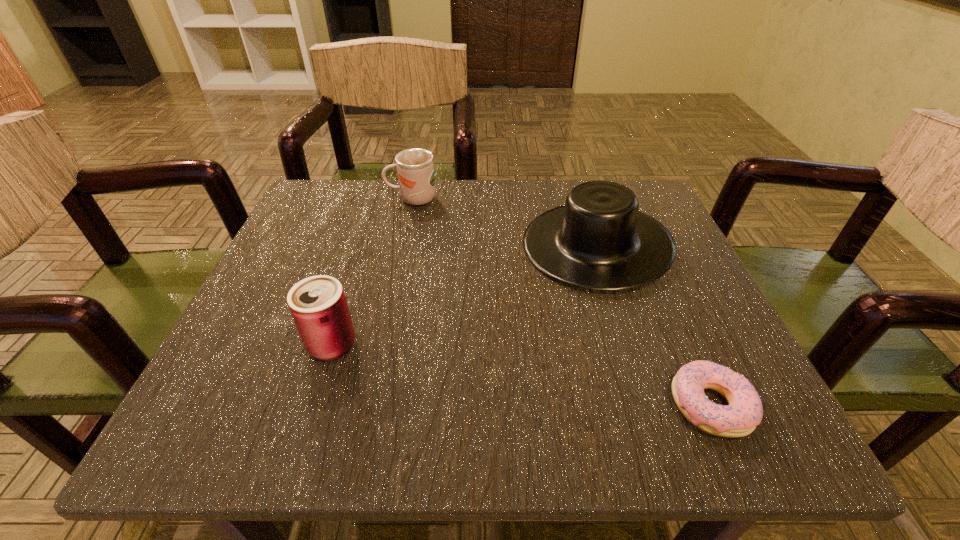
Locate an element on the screen. This screenshot has width=960, height=540. free space at the near edge of the desktop is located at coordinates (584, 416).

You are a GUI agent. You are given a task and a screenshot of the screen. Output one action in this format:
    pyautogui.click(x=<x>, y=<y>)
    Task: Click on the vacant region at the right edge
    This screenshot has height=540, width=960.
    Given the screenshot: What is the action you would take?
    pyautogui.click(x=663, y=314)

At what (x,y) coordinates should I click in order to perform the action: click on free region at the far left corner of the desktop. Please return your answer as a coordinate pair (x, y). Looking at the image, I should click on (312, 199).

In the image, there is a desktop. Find the location of `vacant space at the near right corner`. vacant space at the near right corner is located at coordinates (755, 437).

The width and height of the screenshot is (960, 540). I want to click on unoccupied area between the third farthest object and the doughnut, so click(x=521, y=375).

Where is `free area in between the can and the cup`? free area in between the can and the cup is located at coordinates (372, 272).

Locate an element on the screen. The image size is (960, 540). vacant point located between the nearest object and the dress hat is located at coordinates (654, 325).

Where is `empty location between the third farthest object and the cup`? empty location between the third farthest object and the cup is located at coordinates (372, 272).

The height and width of the screenshot is (540, 960). Find the location of `vacant space in between the can and the dress hat`. vacant space in between the can and the dress hat is located at coordinates (464, 295).

Identify the location of vacant space in between the second nearest object and the dress hat. (464, 295).